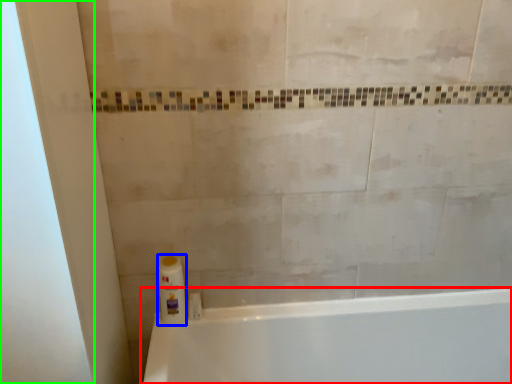
Question: Considering the real-world distances, which object is farthest from bathtub (highlighted by a red box)? cleaning product (highlighted by a blue box) or screen door (highlighted by a green box)?

Choices:
 (A) cleaning product
 (B) screen door

Answer: (B)